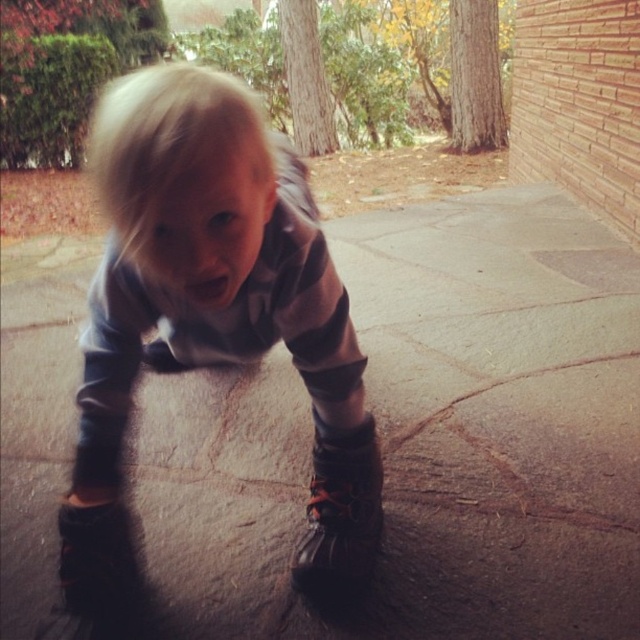
Question: Estimate the real-world distances between objects in this image. Which object is closer to the leather boot at lower left?

Choices:
 (A) black leather boot at lower center
 (B) gray fleece hoodie at center
 (C) brown stone pavement at center

Answer: (B)

Question: Which point is closer to the camera?

Choices:
 (A) (176, 202)
 (B) (504, 387)
 (C) (291, 566)
 (D) (77, 506)

Answer: (A)

Question: Does black leather boot at lower center appear under leather boot at lower left?

Choices:
 (A) yes
 (B) no

Answer: (B)

Question: Observing the image, what is the correct spatial positioning of gray fleece hoodie at center in reference to leather boot at lower left?

Choices:
 (A) left
 (B) right

Answer: (B)

Question: Which point is farther to the camera?

Choices:
 (A) (324, 500)
 (B) (355, 547)
 (C) (636, 621)

Answer: (A)

Question: Considering the relative positions of brown stone pavement at center and black leather boot at lower center in the image provided, where is brown stone pavement at center located with respect to black leather boot at lower center?

Choices:
 (A) below
 (B) above

Answer: (B)